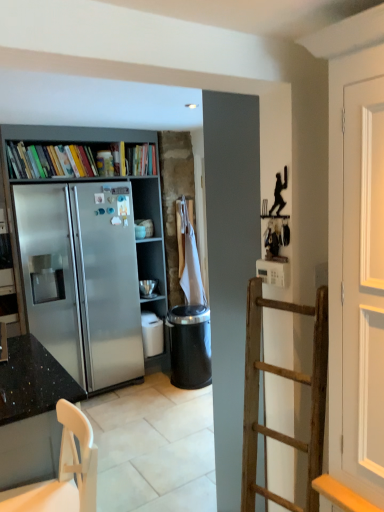
Question: Is granite black countertop at left bigger or smaller than white plastic chair at lower left?

Choices:
 (A) big
 (B) small

Answer: (A)

Question: Looking at their shapes, would you say granite black countertop at left is wider or thinner than white plastic chair at lower left?

Choices:
 (A) wide
 (B) thin

Answer: (A)

Question: Which of these objects is positioned farthest from the satin silver bookcase at left?

Choices:
 (A) granite black countertop at left
 (B) multicolored paperbacks at upper left
 (C) white plastic chair at lower left
 (D) black plastic trash can at center

Answer: (C)

Question: Which of these objects is positioned farthest from the multicolored paperbacks at upper left?

Choices:
 (A) black plastic trash can at center
 (B) granite black countertop at left
 (C) white plastic chair at lower left
 (D) satin silver bookcase at left

Answer: (C)